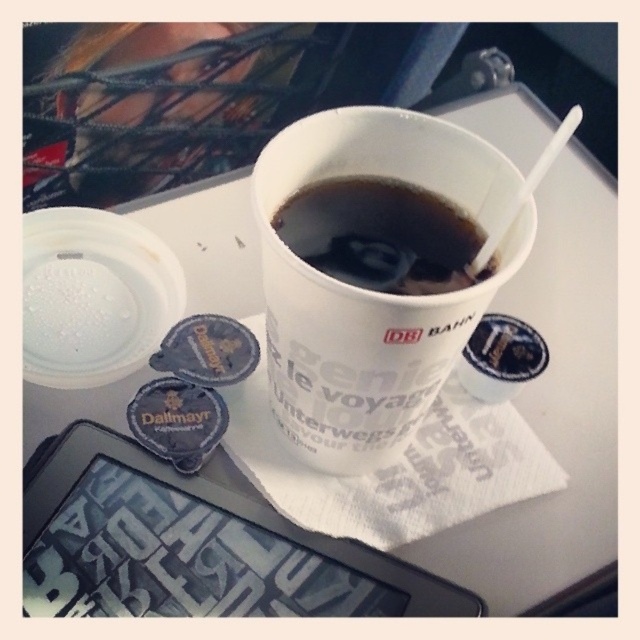
Who is positioned more to the right, white paper cup at center or black paper cup at upper center?

black paper cup at upper center is more to the right.

Is point (352, 394) farther from camera compared to point (435, 257)?

Yes, it is.

Locate an element on the screen. The width and height of the screenshot is (640, 640). white paper cup at center is located at coordinates pos(369,291).